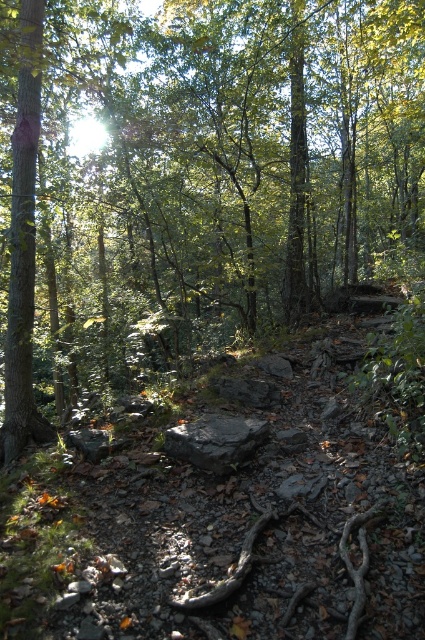
You are a hiker trying to navigate through the forest. You see a green leafy tree at center and a black rock at center. Which object would block your view more if you were standing directly in front of them?

The green leafy tree at center is much taller than the black rock at center, so it would block your view more.

You are a hiker navigating a forest path and notice a green leafy tree at center and a black rock at center. Which object is higher up in the scene?

The green leafy tree at center is above the black rock at center, so it is higher up in the scene.

You are a hiker who wants to take a photo of the black rock at center and the green leafy tree at center. Which object should you focus on first if you want both to be in clear focus?

The black rock at center is narrower than the green leafy tree at center, so you should focus on the green leafy tree at center first to ensure both are in focus.